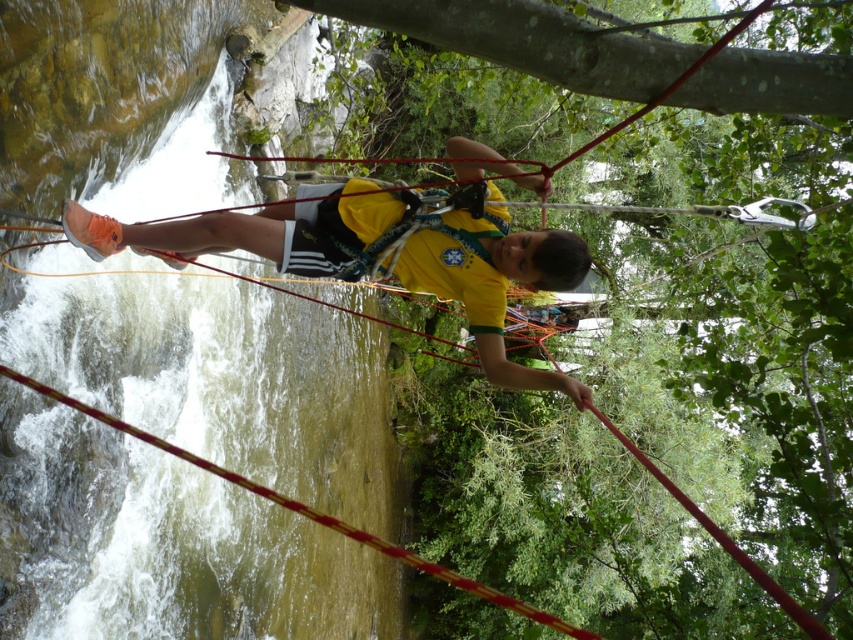
Who is lower down, yellow fabric safety vest at center or red nylon rope at center?

Positioned lower is red nylon rope at center.

Can you confirm if yellow fabric safety vest at center is positioned to the right of red nylon rope at center?

Indeed, yellow fabric safety vest at center is positioned on the right side of red nylon rope at center.

Measure the distance between yellow fabric safety vest at center and camera.

They are 5.09 meters apart.

Identify the location of yellow fabric safety vest at center. (453, 276).

Can you confirm if yellow matte shirt at center is positioned to the left of yellow fabric safety vest at center?

Indeed, yellow matte shirt at center is positioned on the left side of yellow fabric safety vest at center.

Between yellow matte shirt at center and yellow fabric safety vest at center, which one has less height?

yellow fabric safety vest at center

The width and height of the screenshot is (853, 640). In order to click on yellow matte shirt at center in this screenshot , I will do `click(495, 285)`.

Between point (498, 298) and point (16, 372), which one is positioned behind?

The point (16, 372) is behind.

Does yellow matte shirt at center lie behind red nylon rope at center?

No, yellow matte shirt at center is closer to the viewer.

Is point (256, 244) farther from viewer compared to point (376, 541)?

No, it is not.

Identify the location of yellow matte shirt at center. The height and width of the screenshot is (640, 853). (495, 285).